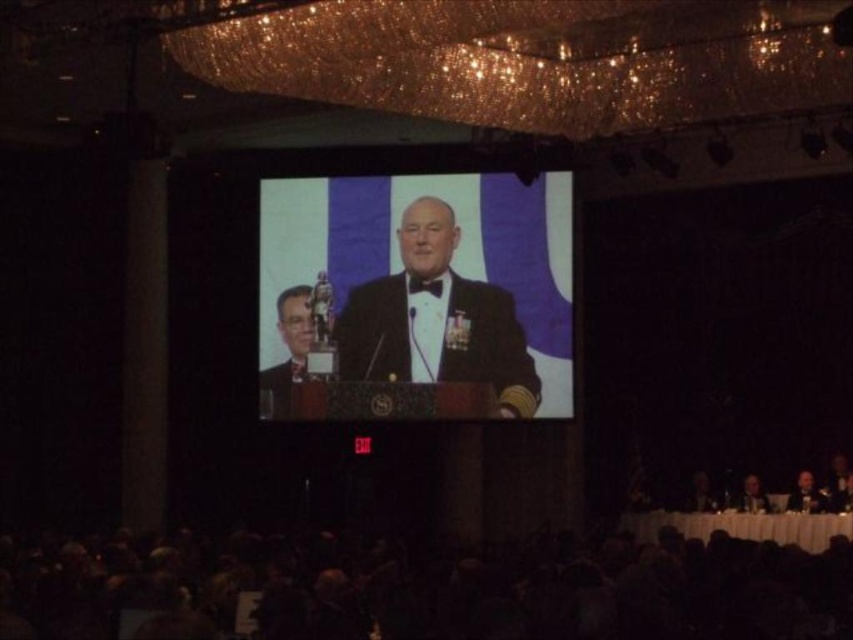
You are an event organizer who needs to ensure all attendees have enough space in the venue. You notice the satin black suit at center and the dark suit at lower right. Which attendee is wearing a wider garment?

The satin black suit at center is wider than the dark suit at lower right, so the attendee wearing the satin black suit at center has a wider garment.

You are an event photographer who needs to capture a closeup of both the matte black suit at center and the smooth skin face at lower right. Given that your camera can only focus on one subject at a time, which subject should you prioritize to ensure the other is still in focus? Explain your reasoning based on their sizes in the image.

The matte black suit at center is larger in size than the smooth skin face at lower right. Therefore, focusing on the larger matte black suit at center will keep the smaller smooth skin face at lower right within the depth of field, ensuring both are in focus.

You are an event photographer who needs to capture a clear photo of both the satin black suit at center and the matte black suit at center. Since you can only focus on one subject at a time, which one should you choose to ensure the other is still somewhat in focus?

The satin black suit at center is closer to the viewer than the matte black suit at center, so focusing on the satin black suit at center will keep the matte black suit at center in better focus compared to focusing on the farther one.